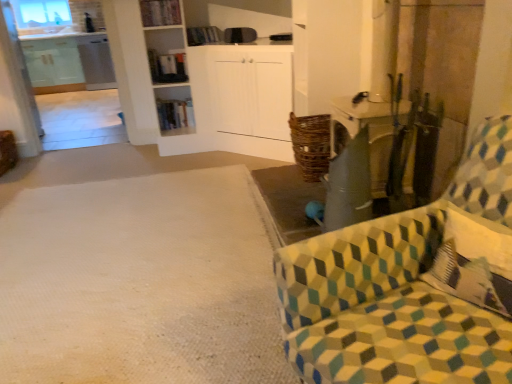
Question: From the image's perspective, relative to white textured carpet at lower left, is wooden bookshelf at center, which ranks as the 2th shelf in front-to-back order, above or below?

Choices:
 (A) above
 (B) below

Answer: (A)

Question: Would you say wooden bookshelf at center, which ranks as the 2th shelf in front-to-back order, is to the left or to the right of white textured carpet at lower left in the picture?

Choices:
 (A) left
 (B) right

Answer: (B)

Question: Which object is positioned farthest from the transparent glass window at upper left?

Choices:
 (A) patterned fabric chair at right
 (B) white textured carpet at lower left
 (C) wooden bookshelf at center, the second shelf positioned from the top
 (D) wooden bookshelf at upper center, positioned as the first shelf in front-to-back order

Answer: (A)

Question: Estimate the real-world distances between objects in this image. Which object is closer to the wooden bookshelf at center, the second shelf positioned from the top?

Choices:
 (A) patterned fabric chair at right
 (B) white textured carpet at lower left
 (C) transparent glass window at upper left
 (D) wooden bookshelf at upper center, acting as the first shelf starting from the top

Answer: (D)